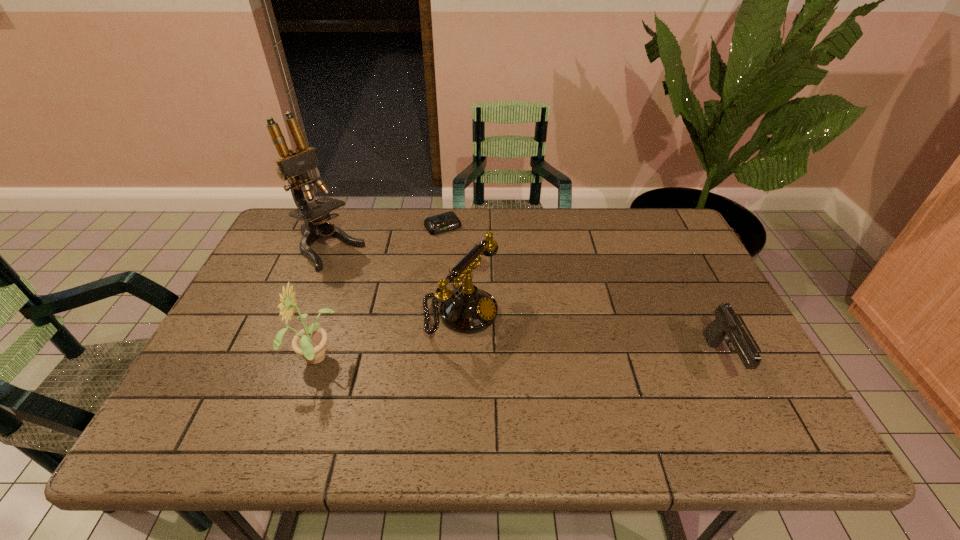
Locate an element on the screen. free space located 0.350m at the eyepieces of the tallest object is located at coordinates (433, 325).

What are the coordinates of `vacant space located 0.260m on the display of the shortest object` in the screenshot? It's located at (489, 285).

This screenshot has height=540, width=960. What are the coordinates of `free space located 0.090m on the display of the shortest object` in the screenshot? It's located at (463, 251).

Where is `free space located on the display of the shortest object`? free space located on the display of the shortest object is located at coordinates (480, 274).

Where is `vacant space situated on the dial of the telephone`? vacant space situated on the dial of the telephone is located at coordinates coord(541,353).

This screenshot has height=540, width=960. Identify the location of free location located on the dial of the telephone. (522, 345).

Locate an element on the screen. The width and height of the screenshot is (960, 540). vacant area situated on the dial of the telephone is located at coordinates (586, 373).

The image size is (960, 540). I want to click on microscope that is at the far edge, so click(293, 165).

I want to click on alarm clock that is positioned at the far edge, so click(x=448, y=221).

The image size is (960, 540). Identify the location of sunflower that is positioned at the near edge. (310, 342).